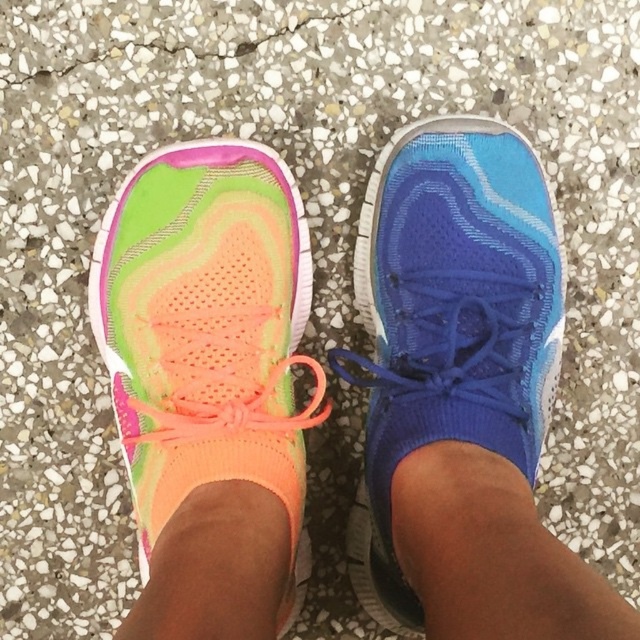
You are standing in front of the two athletic shoes shown in the image. The neon mesh shoe at left is at point 0.608, 0.731. If you want to place a sticker exactly between the two shoes, where should you place it?

The sticker should be placed at the midpoint between the neon mesh shoe at left and the other shoe. Since the neon mesh shoe at left is at point [467,388], the midpoint would require knowing the position of the other shoe, which is not provided. Without the coordinates of the second shoe, an exact placement cannot be determined.

You are standing in front of two neon mesh shoes. The neon mesh shoe at left and the neon mesh shoe at center are both on the ground. Which shoe is more to the left?

The neon mesh shoe at center is more to the left because the neon mesh shoe at left is positioned on the right side of it.

You are a photographer trying to capture both neon mesh shoe at left and neon mesh shoe at center in a single frame. Given that your camera can only focus on objects within a 10 centimeter range, will both shoes be in focus?

The neon mesh shoe at left is 5.85 centimeters away from the neon mesh shoe at center, so both shoes are within the 10 centimeter range. Therefore, both neon mesh shoe at left and neon mesh shoe at center will be in focus.